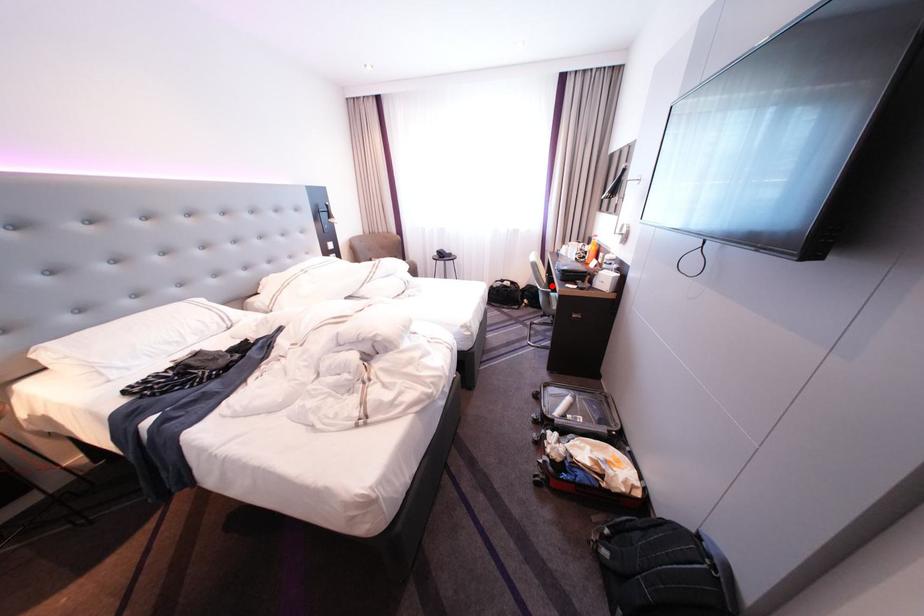
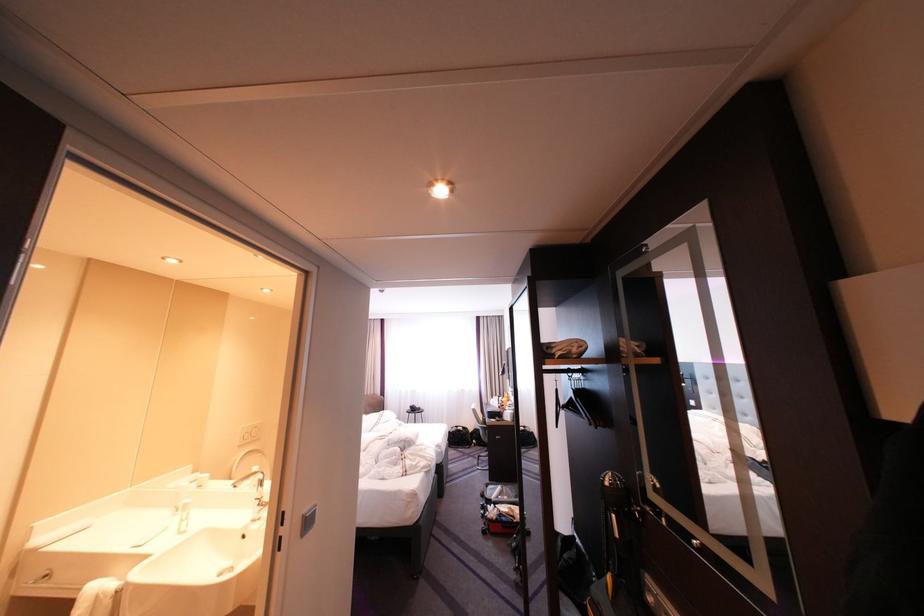
Question: I am providing you with two images of the same scene from different viewpoints. Image1 has a red point marked. In image2, the corresponding 3D location appears at what relative position? Reply with the corresponding letter.

Choices:
 (A) Closer
 (B) Farther

Answer: (B)